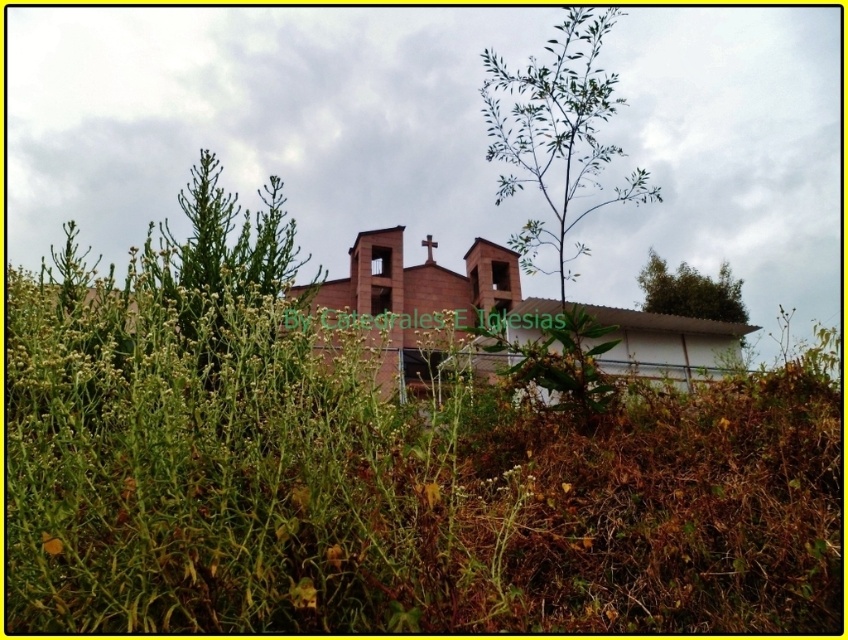
Who is taller, green leafy plant at center or green leafy plant at left?

green leafy plant at center

Can you confirm if green leafy plant at center is smaller than green leafy plant at left?

Yes, green leafy plant at center is smaller than green leafy plant at left.

The height and width of the screenshot is (640, 848). I want to click on green leafy plant at center, so click(x=559, y=182).

Can you confirm if green leafy plant at center is wider than red brick church at center?

No, green leafy plant at center is not wider than red brick church at center.

Does point (579, 192) come closer to viewer compared to point (525, 305)?

Yes, it is.

Identify the location of green leafy plant at center. This screenshot has height=640, width=848. (559, 182).

Between red brick church at center and green leafy plant at left, which one is positioned lower?

red brick church at center is lower down.

Does red brick church at center have a greater height compared to green leafy plant at left?

Yes.

I want to click on red brick church at center, so click(x=430, y=296).